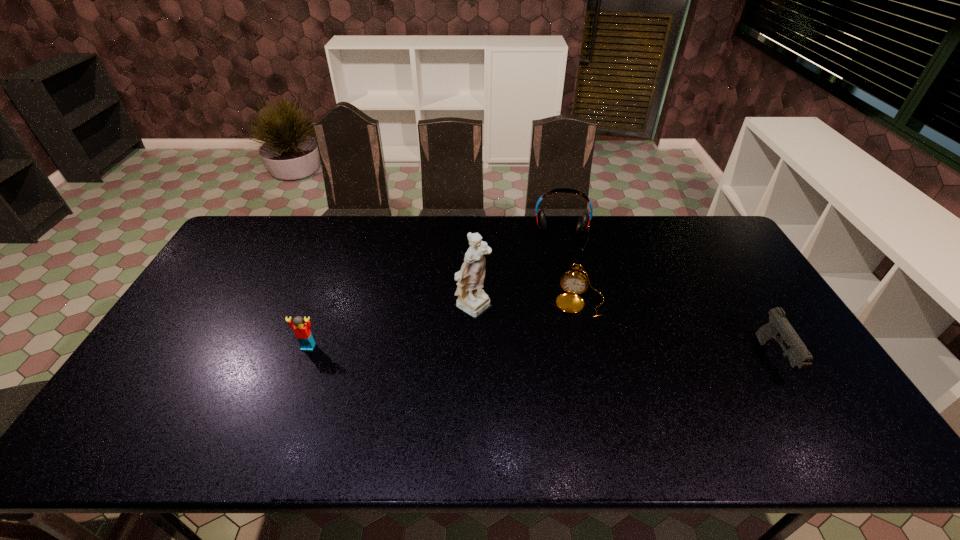
I want to click on empty space between the tallest object and the leftmost object, so click(x=393, y=327).

The height and width of the screenshot is (540, 960). In order to click on free space that is in between the pistol and the second tallest object in this screenshot , I will do [x=668, y=299].

Find the location of a particular element. The width and height of the screenshot is (960, 540). empty location between the fourth shortest object and the pistol is located at coordinates (668, 299).

Locate an element on the screen. The width and height of the screenshot is (960, 540). free area in between the farthest object and the pocket watch is located at coordinates (571, 271).

Where is `free space that is in between the headset and the pocket watch`? The height and width of the screenshot is (540, 960). free space that is in between the headset and the pocket watch is located at coordinates (571, 271).

Find the location of a particular element. The image size is (960, 540). empty space that is in between the pocket watch and the second object from left to right is located at coordinates (528, 305).

In order to click on vacant point located between the rightmost object and the leftmost object in this screenshot , I will do `click(540, 353)`.

Image resolution: width=960 pixels, height=540 pixels. Identify the location of object that is the second nearest to the rightmost object. (583, 225).

Where is `object that ranks as the closest to the headset`? The width and height of the screenshot is (960, 540). object that ranks as the closest to the headset is located at coordinates (574, 282).